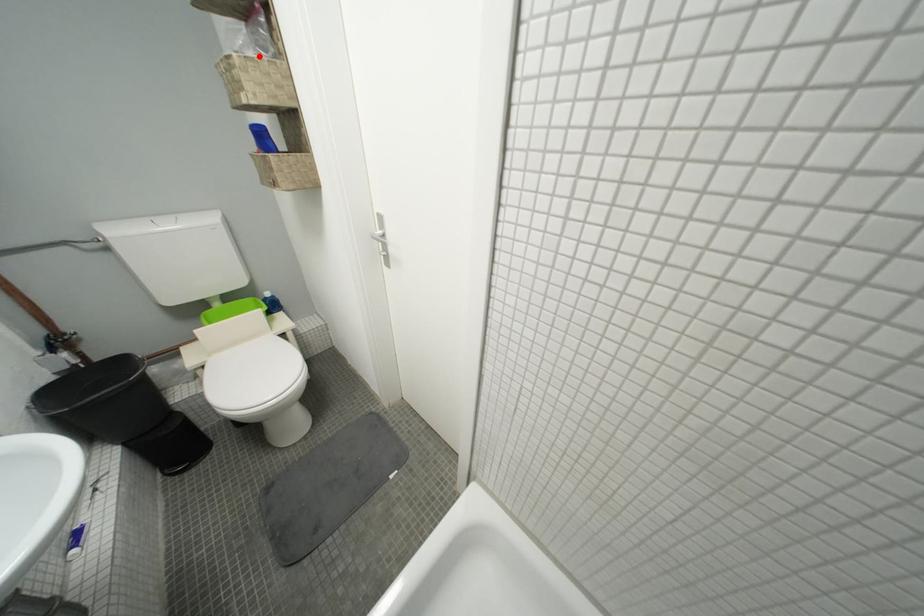
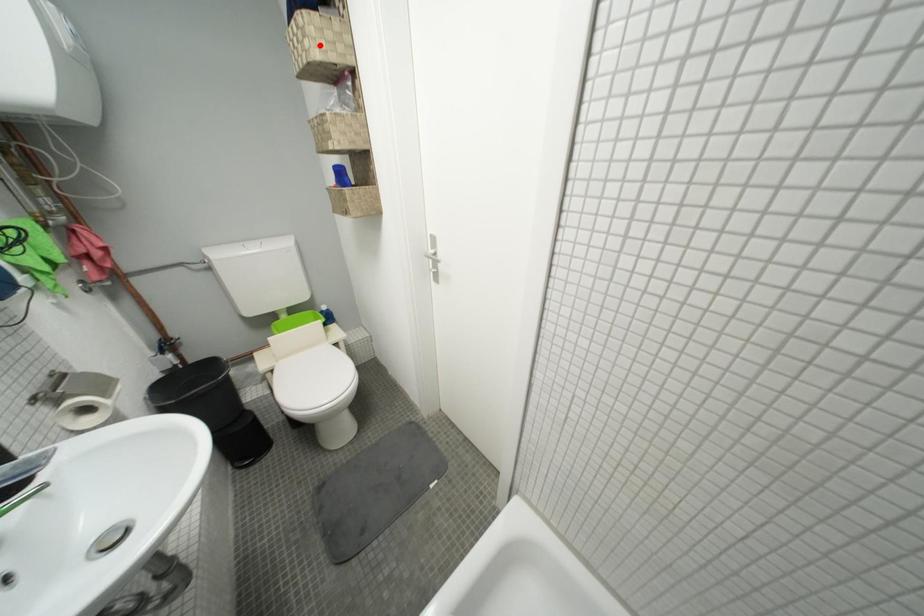
I am providing you with two images of the same scene from different viewpoints. A red point is marked on the first image and another point is marked on the second image. Do the highlighted points in image1 and image2 indicate the same real-world spot?

No